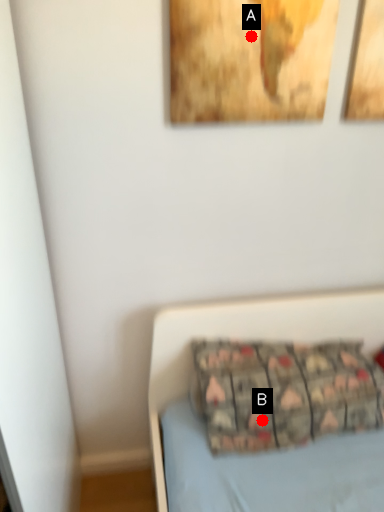
Question: Two points are circled on the image, labeled by A and B beside each circle. Which point is closer to the camera?

Choices:
 (A) A is closer
 (B) B is closer

Answer: (A)